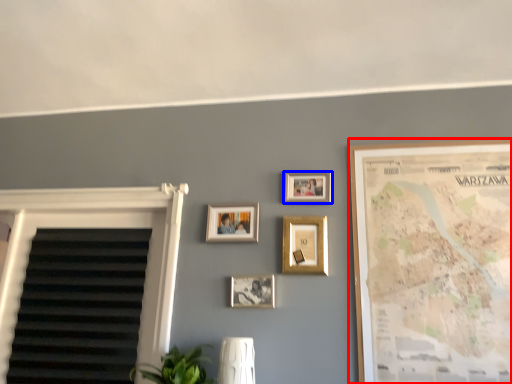
Question: Among these objects, which one is farthest to the camera, picture frame (highlighted by a red box) or picture frame (highlighted by a blue box)?

Choices:
 (A) picture frame
 (B) picture frame

Answer: (B)